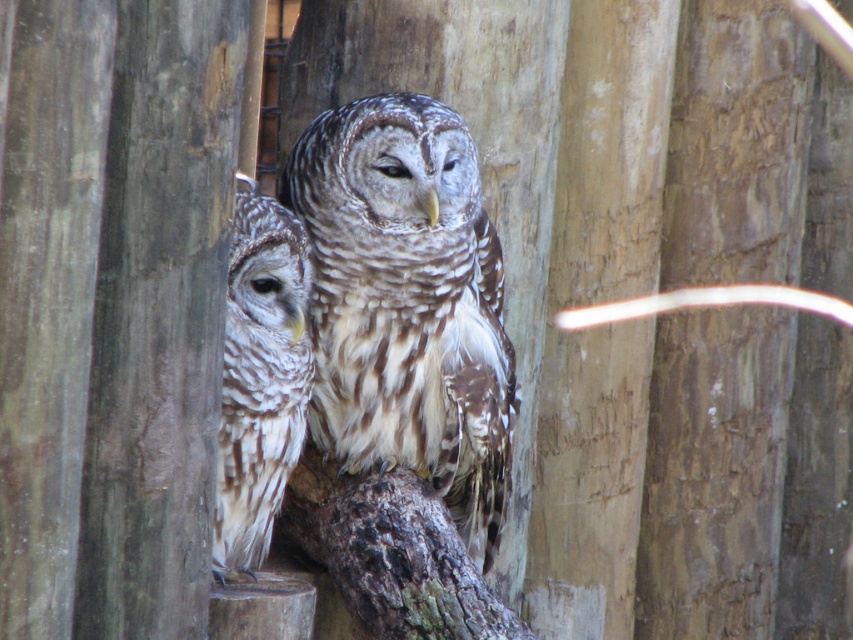
You are a birdwatcher observing two speckled feathered owls in the image. The scene shows a speckled feathered owl at center and a speckled feathered owl at left. Which owl is taller?

The speckled feathered owl at center is taller than the speckled feathered owl at left.